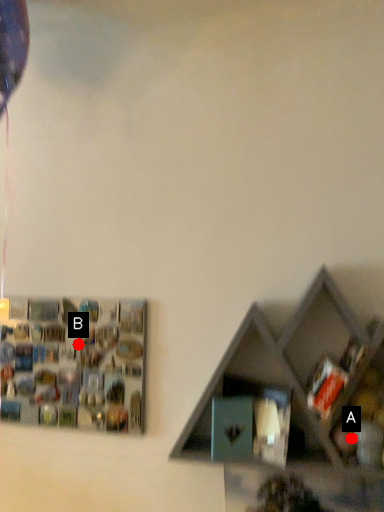
Question: Two points are circled on the image, labeled by A and B beside each circle. Which point is closer to the camera?

Choices:
 (A) A is closer
 (B) B is closer

Answer: (A)